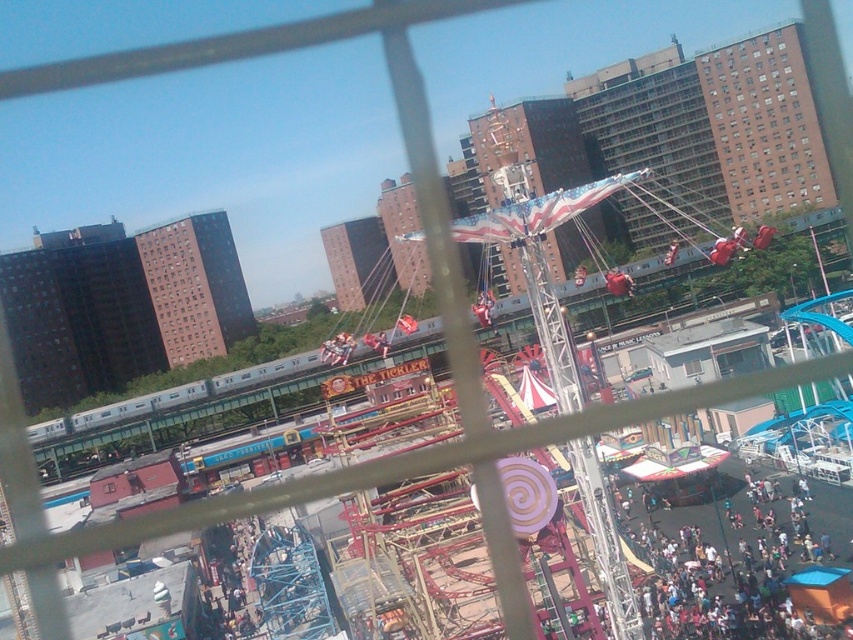
You are standing at the center of the amusement park and looking towards the Ferris wheel. There is a point marked at coordinates point (734, 556). What object or feature is located at this point?

The point (734, 556) corresponds to the dark blue fabric crowd at lower right.

You are standing on the balcony looking down at the amusement park. You see the dark blue fabric crowd at lower right and the brown brick building at upper right. Which object is closer to your current position?

The dark blue fabric crowd at lower right is closer to your current position because it is located below the brown brick building at upper right.

You are standing on the balcony looking down at the amusement park. There are two points marked in the scene, one at coordinates point (848, 547) and another at point (732, 134). Which point is closer to your current position on the balcony?

Point (848, 547) is in front of point (732, 134), so it is closer to your current position on the balcony.